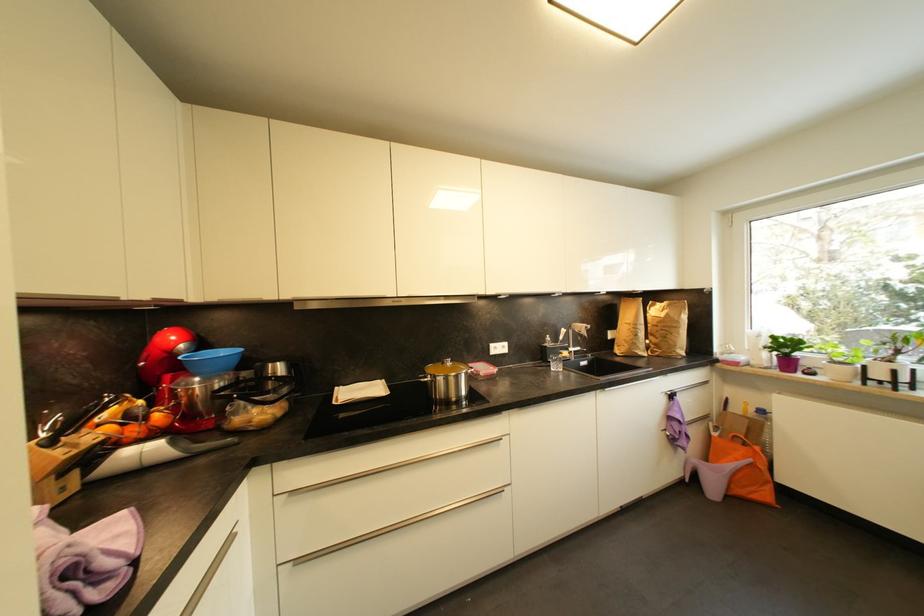
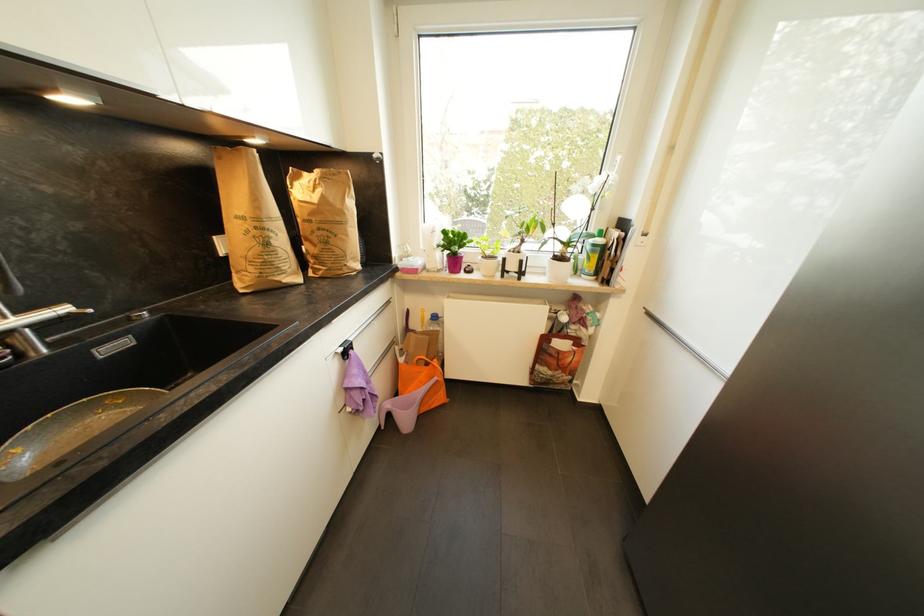
Where in the second image is the point corresponding to point 578,349 from the first image?

(27, 313)